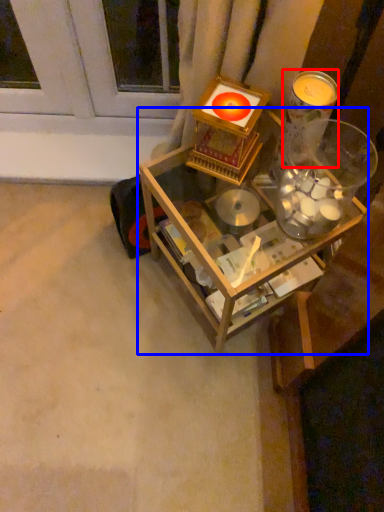
Question: Which point is further to the camera, candle holder (highlighted by a red box) or table (highlighted by a blue box)?

Choices:
 (A) candle holder
 (B) table

Answer: (B)